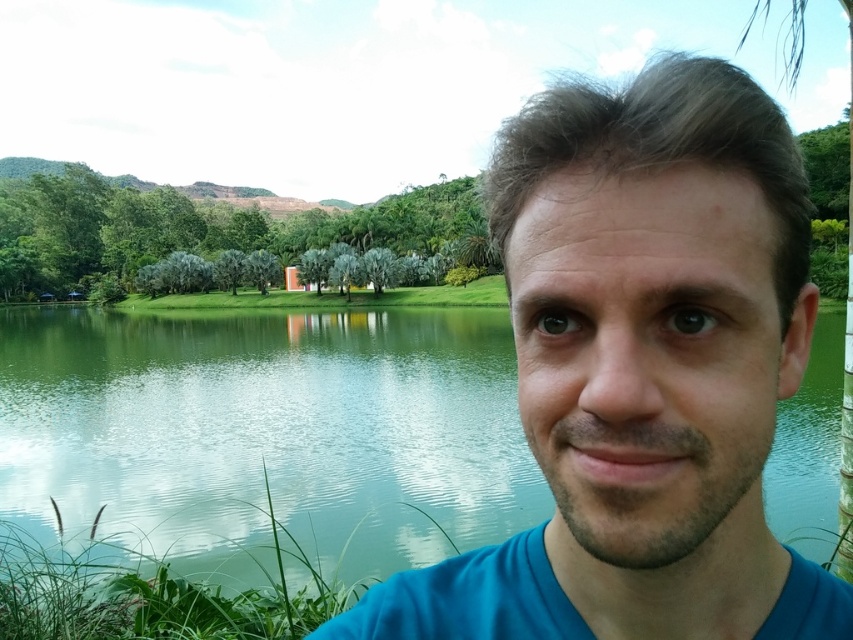
Question: Which point is farther from the camera taking this photo?

Choices:
 (A) (550, 561)
 (B) (50, 336)

Answer: (B)

Question: Is blue fabric face at center thinner than green smooth water at center?

Choices:
 (A) no
 (B) yes

Answer: (B)

Question: Is blue fabric face at center smaller than green smooth water at center?

Choices:
 (A) no
 (B) yes

Answer: (B)

Question: Is blue fabric face at center bigger than green smooth water at center?

Choices:
 (A) yes
 (B) no

Answer: (B)

Question: Which point is closer to the camera?

Choices:
 (A) blue fabric face at center
 (B) green smooth water at center

Answer: (A)